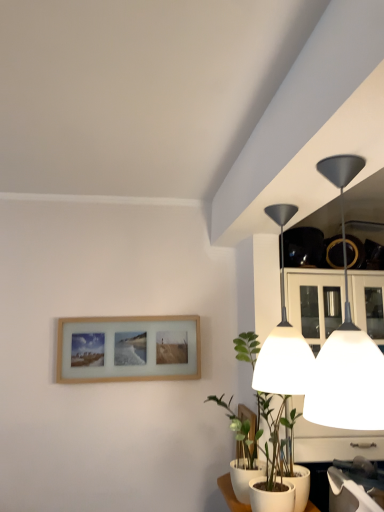
You are a GUI agent. You are given a task and a screenshot of the screen. Output one action in this format:
    pyautogui.click(x=<x>, y=<y>)
    Task: Click on the white matte lampshade at upper right, the first lamp when ordered from back to front
    
    Given the screenshot: What is the action you would take?
    pyautogui.click(x=283, y=338)

Identify the location of matte black lampshade at upper right, which is the 1th lamp from front to back. pyautogui.click(x=346, y=347).

I want to click on wooden picture frame at lower left, the first picture frame in the left-to-right sequence, so click(x=128, y=349).

Is wooden picture frame at lower left, which appears as the first picture frame when viewed from the back, looking in the opposite direction of white matte lampshade at upper right, the first lamp when ordered from back to front?

No, wooden picture frame at lower left, which appears as the first picture frame when viewed from the back,'s orientation is not away from white matte lampshade at upper right, the first lamp when ordered from back to front.

From a real-world perspective, which object stands above the other?

In real-world perspective, white matte lampshade at upper right, the first lamp when ordered from back to front, is above.

Is wooden picture frame at lower left, which appears as the first picture frame when viewed from the back, not inside white matte lampshade at upper right, the first lamp when ordered from back to front?

Yes, wooden picture frame at lower left, which appears as the first picture frame when viewed from the back, is not within white matte lampshade at upper right, the first lamp when ordered from back to front.

Is white matte lampshade at upper right, which is the second lamp from front to back, wider than green matte plant at lower right?

In fact, white matte lampshade at upper right, which is the second lamp from front to back, might be narrower than green matte plant at lower right.

Which point is more forward, (274, 383) or (291, 486)?

Positioned in front is point (274, 383).

From a real-world perspective, is white matte lampshade at upper right, the first lamp when ordered from back to front, positioned over green matte plant at lower right based on gravity?

Correct, in the physical world, white matte lampshade at upper right, the first lamp when ordered from back to front, is higher than green matte plant at lower right.

Is white matte lampshade at upper right, the first lamp when ordered from back to front, positioned far away from green matte plant at lower right?

Actually, white matte lampshade at upper right, the first lamp when ordered from back to front, and green matte plant at lower right are a little close together.

How many degrees apart are the facing directions of matte black lampshade at upper right, which is the 1th lamp from front to back, and white matte lampshade at upper right, the first lamp when ordered from back to front?

3.48 degrees.

In terms of size, does matte black lampshade at upper right, which is the 2th lamp in back-to-front order, appear bigger or smaller than white matte lampshade at upper right, which is the second lamp from front to back?

Clearly, matte black lampshade at upper right, which is the 2th lamp in back-to-front order, is smaller in size than white matte lampshade at upper right, which is the second lamp from front to back.

Is matte black lampshade at upper right, which is the 2th lamp in back-to-front order, turned away from white matte lampshade at upper right, which is the second lamp from front to back?

No, matte black lampshade at upper right, which is the 2th lamp in back-to-front order,'s orientation is not away from white matte lampshade at upper right, which is the second lamp from front to back.

Is matte black lampshade at upper right, which is the 2th lamp in back-to-front order, touching white matte lampshade at upper right, the first lamp when ordered from back to front?

No, matte black lampshade at upper right, which is the 2th lamp in back-to-front order, is not in contact with white matte lampshade at upper right, the first lamp when ordered from back to front.

Are wooden picture frame at lower left, the first picture frame in the left-to-right sequence, and green matte plant at lower right making contact?

There is a gap between wooden picture frame at lower left, the first picture frame in the left-to-right sequence, and green matte plant at lower right.

Considering the sizes of objects wooden picture frame at lower left, the 2th picture frame when ordered from right to left, and green matte plant at lower right in the image provided, who is shorter, wooden picture frame at lower left, the 2th picture frame when ordered from right to left, or green matte plant at lower right?

With less height is wooden picture frame at lower left, the 2th picture frame when ordered from right to left.

Considering the positions of objects wooden picture frame at lower left, the 2th picture frame when ordered from front to back, and green matte plant at lower right in the image provided, who is in front, wooden picture frame at lower left, the 2th picture frame when ordered from front to back, or green matte plant at lower right?

Positioned in front is green matte plant at lower right.

How many degrees apart are the facing directions of wooden picture frame at lower center, the second picture frame from the back, and wooden picture frame at lower left, the 2th picture frame when ordered from right to left?

The angular difference between wooden picture frame at lower center, the second picture frame from the back, and wooden picture frame at lower left, the 2th picture frame when ordered from right to left, is 89.1 degrees.

From the image's perspective, relative to wooden picture frame at lower left, the 1th picture frame positioned from the top, is wooden picture frame at lower center, placed as the first picture frame when sorted from right to left, above or below?

Based on their image positions, wooden picture frame at lower center, placed as the first picture frame when sorted from right to left, is located beneath wooden picture frame at lower left, the 1th picture frame positioned from the top.

Is wooden picture frame at lower center, which appears as the second picture frame when viewed from the left, touching wooden picture frame at lower left, the 2th picture frame when ordered from front to back?

wooden picture frame at lower center, which appears as the second picture frame when viewed from the left, is not next to wooden picture frame at lower left, the 2th picture frame when ordered from front to back, and they're not touching.

Is wooden picture frame at lower center, placed as the first picture frame when sorted from right to left, looking in the opposite direction of wooden picture frame at lower left, the first picture frame in the left-to-right sequence?

wooden picture frame at lower center, placed as the first picture frame when sorted from right to left, does not have its back to wooden picture frame at lower left, the first picture frame in the left-to-right sequence.

Is green matte plant at lower right beside white matte lampshade at upper right, the first lamp when ordered from back to front?

They are not placed beside each other.

What's the angular difference between green matte plant at lower right and white matte lampshade at upper right, the first lamp when ordered from back to front,'s facing directions?

3.48 degrees.

Is green matte plant at lower right surrounding white matte lampshade at upper right, the first lamp when ordered from back to front?

No, green matte plant at lower right does not contain white matte lampshade at upper right, the first lamp when ordered from back to front.

Can you confirm if green matte plant at lower right is smaller than white matte lampshade at upper right, the first lamp when ordered from back to front?

No, green matte plant at lower right is not smaller than white matte lampshade at upper right, the first lamp when ordered from back to front.

Can you confirm if white matte lampshade at upper right, the first lamp when ordered from back to front, is bigger than wooden picture frame at lower left, the 2th picture frame when ordered from right to left?

Yes.

Is white matte lampshade at upper right, which is the second lamp from front to back, facing towards wooden picture frame at lower left, the 2th picture frame when ordered from front to back?

No, white matte lampshade at upper right, which is the second lamp from front to back, is not turned towards wooden picture frame at lower left, the 2th picture frame when ordered from front to back.

Is white matte lampshade at upper right, the first lamp when ordered from back to front, positioned beyond the bounds of wooden picture frame at lower left, the first picture frame in the left-to-right sequence?

That's correct, white matte lampshade at upper right, the first lamp when ordered from back to front, is outside of wooden picture frame at lower left, the first picture frame in the left-to-right sequence.

Between white matte lampshade at upper right, the first lamp when ordered from back to front, and wooden picture frame at lower left, the first picture frame in the left-to-right sequence, which one has less height?

Standing shorter between the two is wooden picture frame at lower left, the first picture frame in the left-to-right sequence.

I want to click on the 1st lamp above the wooden picture frame at lower left, the 1th picture frame positioned from the top (from the image's perspective), so click(x=283, y=338).

The height and width of the screenshot is (512, 384). In the image, there is a white matte lampshade at upper right, the first lamp when ordered from back to front. Identify the location of houseplant below it (from the image's perspective). (275, 467).

When comparing their distances from white matte lampshade at upper right, the first lamp when ordered from back to front, does matte black lampshade at upper right, which is the 1th lamp from front to back, or wooden picture frame at lower center, the second picture frame from the back, seem further?

Based on the image, wooden picture frame at lower center, the second picture frame from the back, appears to be further to white matte lampshade at upper right, the first lamp when ordered from back to front.

Looking at the image, which one is located further to matte black lampshade at upper right, which is the 1th lamp from front to back, green matte plant at lower right or wooden picture frame at lower center, the second picture frame positioned from the top?

Among the two, wooden picture frame at lower center, the second picture frame positioned from the top, is located further to matte black lampshade at upper right, which is the 1th lamp from front to back.

From the image, which object appears to be nearer to white matte lampshade at upper right, which is the second lamp from front to back, green matte plant at lower right or wooden picture frame at lower left, the 2th picture frame when ordered from front to back?

The object closer to white matte lampshade at upper right, which is the second lamp from front to back, is green matte plant at lower right.

From the image, which object appears to be nearer to wooden picture frame at lower left, the 1th picture frame positioned from the top, matte black lampshade at upper right, which is the 1th lamp from front to back, or white matte lampshade at upper right, the first lamp when ordered from back to front?

white matte lampshade at upper right, the first lamp when ordered from back to front, is closer to wooden picture frame at lower left, the 1th picture frame positioned from the top.

From the image, which object appears to be farther from white matte lampshade at upper right, which is the second lamp from front to back, wooden picture frame at lower center, acting as the first picture frame starting from the front, or matte black lampshade at upper right, which is the 1th lamp from front to back?

Among the two, wooden picture frame at lower center, acting as the first picture frame starting from the front, is located further to white matte lampshade at upper right, which is the second lamp from front to back.

Based on their spatial positions, is matte black lampshade at upper right, which is the 2th lamp in back-to-front order, or wooden picture frame at lower left, the 1th picture frame positioned from the top, further from wooden picture frame at lower center, acting as the first picture frame starting from the front?

Based on the image, matte black lampshade at upper right, which is the 2th lamp in back-to-front order, appears to be further to wooden picture frame at lower center, acting as the first picture frame starting from the front.

When comparing their distances from wooden picture frame at lower center, which appears as the second picture frame when viewed from the left, does wooden picture frame at lower left, which appears as the first picture frame when viewed from the back, or matte black lampshade at upper right, which is the 1th lamp from front to back, seem closer?

wooden picture frame at lower left, which appears as the first picture frame when viewed from the back, is positioned closer to the anchor wooden picture frame at lower center, which appears as the second picture frame when viewed from the left.

Which object lies further to the anchor point wooden picture frame at lower left, the first picture frame in the left-to-right sequence, wooden picture frame at lower center, placed as the 1th picture frame when sorted from bottom to top, or green matte plant at lower right?

green matte plant at lower right is positioned further to the anchor wooden picture frame at lower left, the first picture frame in the left-to-right sequence.

Identify the location of houseplant between wooden picture frame at lower left, which appears as the first picture frame when viewed from the back, and wooden picture frame at lower center, the second picture frame positioned from the top, in the horizontal direction. The image size is (384, 512). tap(275, 467).

You are a GUI agent. You are given a task and a screenshot of the screen. Output one action in this format:
    pyautogui.click(x=<x>, y=<y>)
    Task: Click on the houseplant between white matte lampshade at upper right, which is the second lamp from front to back, and wooden picture frame at lower left, the first picture frame in the left-to-right sequence, from front to back
    
    Given the screenshot: What is the action you would take?
    pyautogui.click(x=275, y=467)

This screenshot has width=384, height=512. What are the coordinates of `picture frame positioned between matte black lampshade at upper right, which is the 1th lamp from front to back, and wooden picture frame at lower left, the 2th picture frame when ordered from right to left, from near to far` in the screenshot? It's located at (248, 419).

The image size is (384, 512). I want to click on houseplant between white matte lampshade at upper right, the first lamp when ordered from back to front, and wooden picture frame at lower center, which appears as the second picture frame when viewed from the left, in the vertical direction, so click(275, 467).